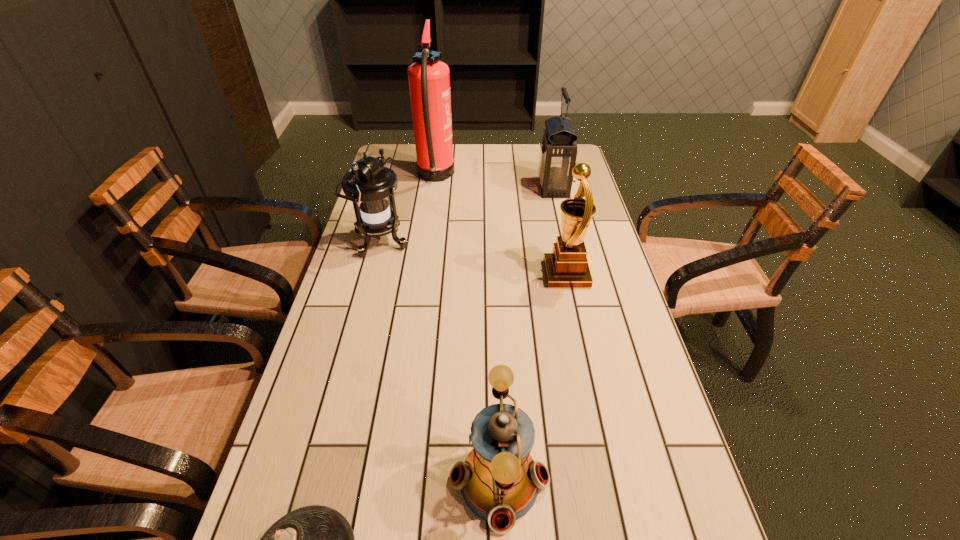
This screenshot has height=540, width=960. I want to click on empty space that is in between the second shortest object and the leftmost lantern, so click(x=440, y=362).

Find the location of a particular element. object that is the third closest to the farthest lantern is located at coordinates (369, 185).

The width and height of the screenshot is (960, 540). Identify the location of the third closest object to the candle. (566, 267).

Identify which lantern is the second closest to the farthest lantern. Please provide its 2D coordinates. Your answer should be formatted as a tuple, i.e. [(x, y)], where the tuple contains the x and y coordinates of a point satisfying the conditions above.

[(499, 480)]

Identify which lantern is the nearest to the second nearest lantern. Please provide its 2D coordinates. Your answer should be formatted as a tuple, i.e. [(x, y)], where the tuple contains the x and y coordinates of a point satisfying the conditions above.

[(558, 151)]

At what (x,y) coordinates should I click in order to perform the action: click on free spot that satisfies the following two spatial constraints: 1. at the nozzle of the fire extinguisher; 2. on the front side of the second farthest lantern. Please return your answer as a coordinate pair (x, y). The height and width of the screenshot is (540, 960). Looking at the image, I should click on (426, 242).